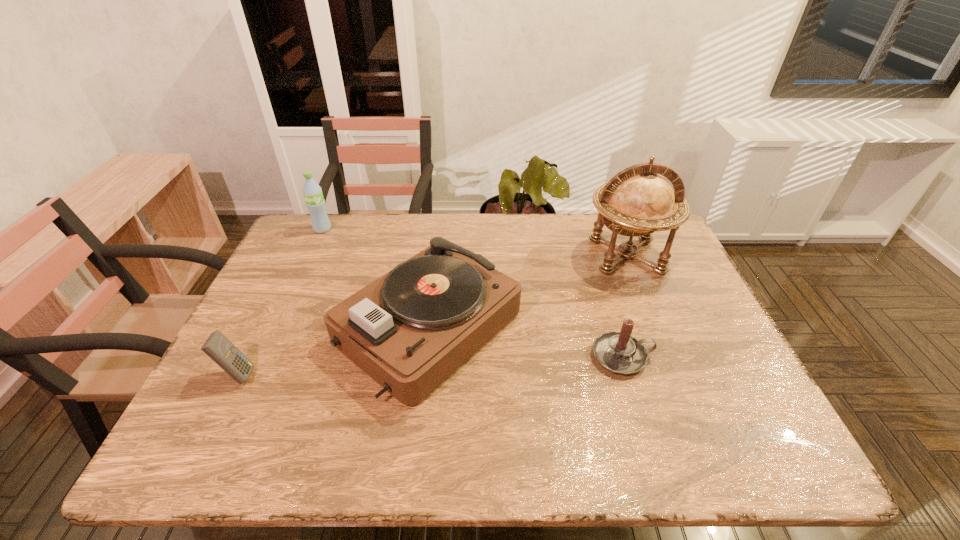
Locate an element on the screen. vacant space at the right edge is located at coordinates (706, 330).

Image resolution: width=960 pixels, height=540 pixels. In the image, there is a desktop. Find the location of `free region at the far left corner`. free region at the far left corner is located at coordinates (323, 250).

Locate an element on the screen. free space between the tallest object and the candle is located at coordinates (624, 306).

Identify the location of free space that is in between the tallest object and the candle. The height and width of the screenshot is (540, 960). (624, 306).

The image size is (960, 540). In order to click on free spot between the calculator and the third object from left to right in this screenshot , I will do `click(334, 350)`.

You are a GUI agent. You are given a task and a screenshot of the screen. Output one action in this format:
    pyautogui.click(x=<x>, y=<y>)
    Task: Click on the free area in between the fourth shortest object and the globe
    The image size is (960, 540).
    Given the screenshot: What is the action you would take?
    pyautogui.click(x=474, y=242)

At what (x,y) coordinates should I click in order to perform the action: click on vacant area between the calculator and the second tallest object. Please return your answer as a coordinate pair (x, y). The height and width of the screenshot is (540, 960). Looking at the image, I should click on (280, 302).

Where is `empty location between the water bottle and the calculator`? Image resolution: width=960 pixels, height=540 pixels. empty location between the water bottle and the calculator is located at coordinates (280, 302).

The image size is (960, 540). Find the location of `object that is the second closest to the calculator`. object that is the second closest to the calculator is located at coordinates (312, 192).

This screenshot has height=540, width=960. Identify the location of object identified as the third closest to the candle. (222, 351).